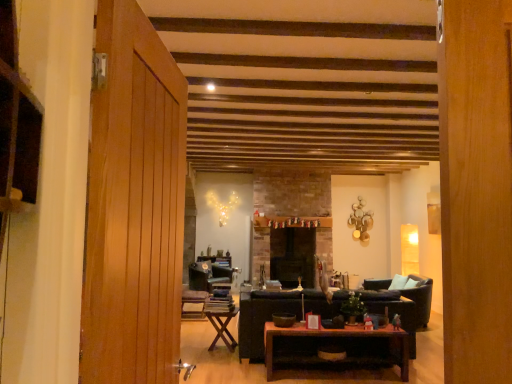
Question: From the image's perspective, is wooden door at left above black stone fireplace at center?

Choices:
 (A) no
 (B) yes

Answer: (B)

Question: Considering the relative sizes of wooden door at left and black stone fireplace at center in the image provided, is wooden door at left taller than black stone fireplace at center?

Choices:
 (A) yes
 (B) no

Answer: (B)

Question: Is wooden door at left positioned beyond the bounds of black stone fireplace at center?

Choices:
 (A) no
 (B) yes

Answer: (B)

Question: Is wooden door at left facing away from black stone fireplace at center?

Choices:
 (A) yes
 (B) no

Answer: (B)

Question: Is wooden door at left at the left side of black stone fireplace at center?

Choices:
 (A) no
 (B) yes

Answer: (B)

Question: In terms of width, does black stone fireplace at center look wider or thinner when compared to wooden textured chair at center, the second chair when ordered from back to front?

Choices:
 (A) wide
 (B) thin

Answer: (A)

Question: Relative to wooden textured chair at center, the 1th chair viewed from the front, is black stone fireplace at center in front or behind?

Choices:
 (A) behind
 (B) front

Answer: (A)

Question: Considering the positions of point (274, 228) and point (181, 302), is point (274, 228) closer or farther from the camera than point (181, 302)?

Choices:
 (A) farther
 (B) closer

Answer: (A)

Question: From the image's perspective, is black stone fireplace at center above or below wooden textured chair at center, the 1th chair viewed from the front?

Choices:
 (A) above
 (B) below

Answer: (A)

Question: In terms of width, does wooden polished coffee table at center look wider or thinner when compared to black stone fireplace at center?

Choices:
 (A) thin
 (B) wide

Answer: (A)

Question: From their relative heights in the image, would you say wooden polished coffee table at center is taller or shorter than black stone fireplace at center?

Choices:
 (A) tall
 (B) short

Answer: (B)

Question: From a real-world perspective, is wooden polished coffee table at center positioned above or below black stone fireplace at center?

Choices:
 (A) above
 (B) below

Answer: (B)

Question: Visually, is wooden polished coffee table at center positioned to the left or to the right of black stone fireplace at center?

Choices:
 (A) right
 (B) left

Answer: (A)

Question: From the image's perspective, is wooden textured chair at center, the second chair when ordered from back to front, located above or below wooden polished coffee table at center?

Choices:
 (A) above
 (B) below

Answer: (B)

Question: Considering the positions of wooden textured chair at center, the 1th chair viewed from the front, and wooden polished coffee table at center in the image, is wooden textured chair at center, the 1th chair viewed from the front, taller or shorter than wooden polished coffee table at center?

Choices:
 (A) tall
 (B) short

Answer: (B)